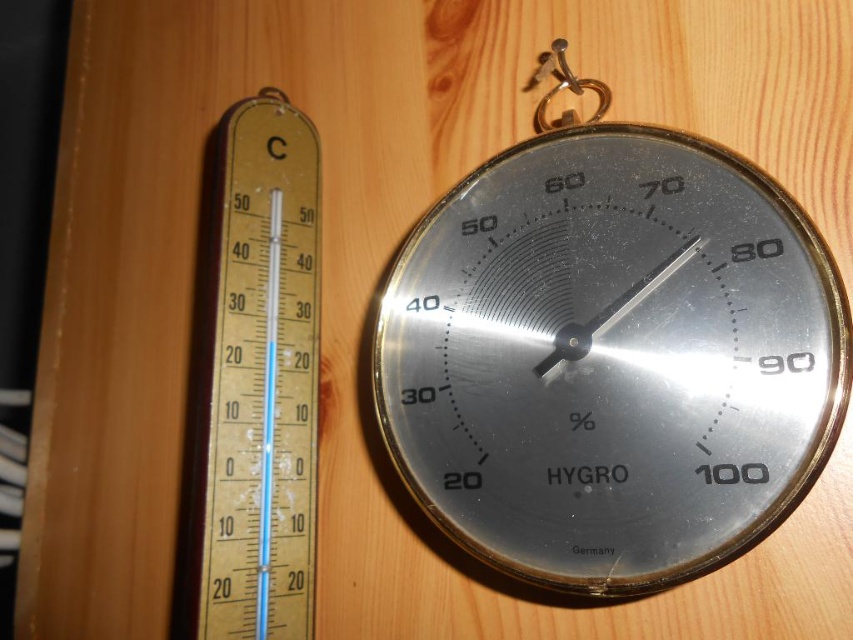
Question: Does gold textured thermometer at left appear on the right side of gold metallic hook at upper center?

Choices:
 (A) yes
 (B) no

Answer: (B)

Question: Does gold textured thermometer at left have a lesser width compared to gold metallic hook at upper center?

Choices:
 (A) no
 (B) yes

Answer: (A)

Question: Which object is positioned farthest from the gold textured thermometer at left?

Choices:
 (A) metallic silver hygrometer at center
 (B) gold metallic hook at upper center

Answer: (B)

Question: Does metallic silver hygrometer at center have a lesser width compared to gold metallic hook at upper center?

Choices:
 (A) yes
 (B) no

Answer: (B)

Question: Based on their relative distances, which object is nearer to the gold textured thermometer at left?

Choices:
 (A) gold metallic hook at upper center
 (B) metallic silver hygrometer at center

Answer: (B)

Question: Which of the following is the farthest from the observer?

Choices:
 (A) gold metallic hook at upper center
 (B) metallic silver hygrometer at center

Answer: (A)